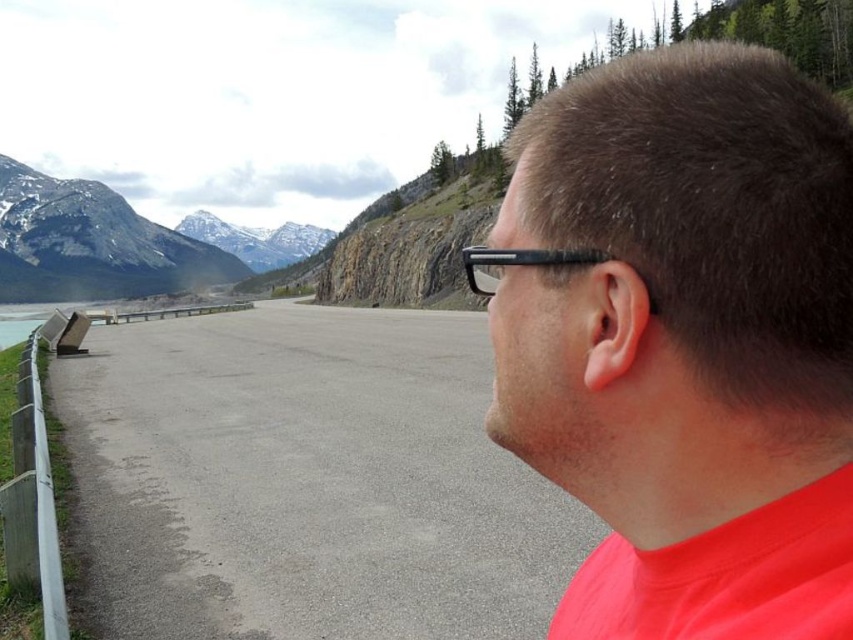
Is matte black glasses at upper right closer to camera compared to brushed metal bench at left?

Yes, matte black glasses at upper right is closer to the viewer.

Can you confirm if matte black glasses at upper right is positioned to the right of brushed metal bench at left?

Indeed, matte black glasses at upper right is positioned on the right side of brushed metal bench at left.

Between point (827, 106) and point (45, 317), which one is positioned behind?

Positioned behind is point (45, 317).

Locate an element on the screen. This screenshot has height=640, width=853. matte black glasses at upper right is located at coordinates (685, 340).

Looking at this image, is gray asphalt road at center above rocky gray mountain at left?

No, gray asphalt road at center is not above rocky gray mountain at left.

Does gray asphalt road at center have a smaller size compared to rocky gray mountain at left?

Correct, gray asphalt road at center occupies less space than rocky gray mountain at left.

Does point (299, 355) come farther from viewer compared to point (82, 198)?

No, it is in front of (82, 198).

Locate an element on the screen. This screenshot has width=853, height=640. gray asphalt road at center is located at coordinates (306, 481).

Can you confirm if gray asphalt road at center is positioned to the left of brushed metal bench at left?

In fact, gray asphalt road at center is to the right of brushed metal bench at left.

Between gray asphalt road at center and brushed metal bench at left, which one has more height?

brushed metal bench at left is taller.

The height and width of the screenshot is (640, 853). What do you see at coordinates (306, 481) in the screenshot?
I see `gray asphalt road at center` at bounding box center [306, 481].

Locate an element on the screen. Image resolution: width=853 pixels, height=640 pixels. gray asphalt road at center is located at coordinates (306, 481).